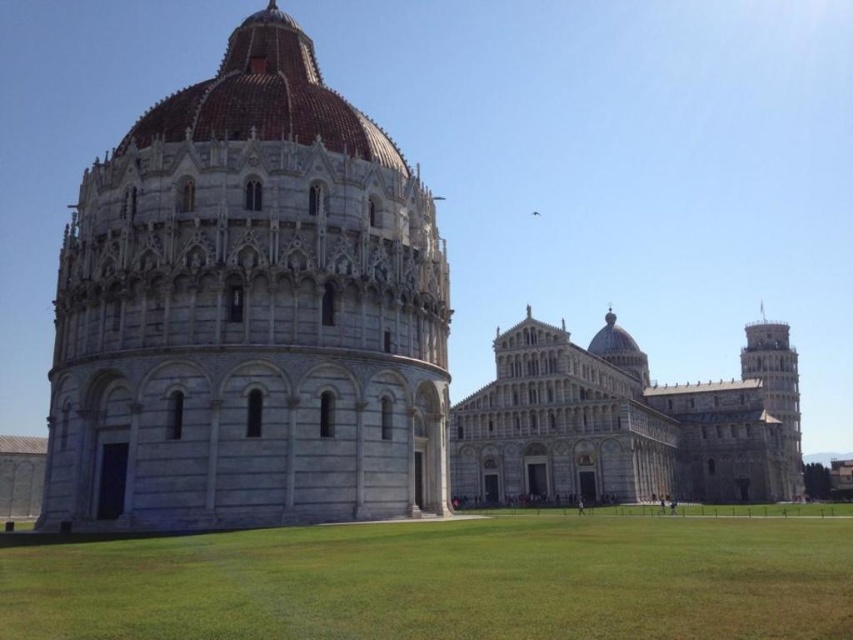
You are an architect visiting Piazza dei Miracoli. You notice the white marble tower at center and the gray stone leaning tower at right. Which one has a greater height?

The gray stone leaning tower at right is taller than the white marble tower at center.

You are an architect visiting Piazza dei Miracoli. You notice the brown tiled dome at upper center and the gray stone leaning tower at right. Which structure has a greater height?

The gray stone leaning tower at right is taller than the brown tiled dome at upper center.

You are standing in Piazza dei Miracoli and see the green grass at lower center and the brown tiled dome at upper center. Which object is closer to the ground?

The green grass at lower center is closer to the ground as it is positioned below the brown tiled dome at upper center.